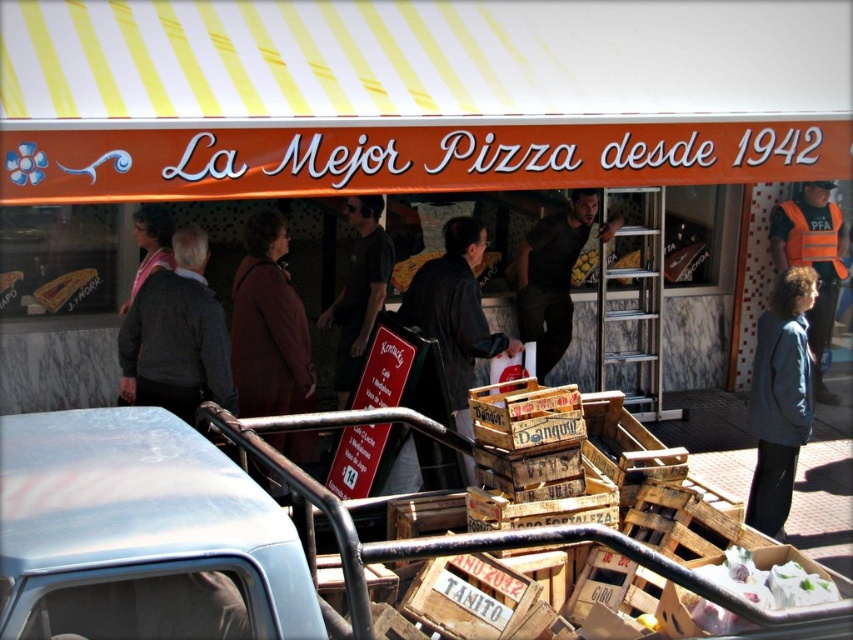
Looking at this image, you are standing in front of the pizza shop and see both the dark brown leather jacket at center and the dark gray shirt at center. Which one is physically closer to you?

The dark brown leather jacket at center is closer to the viewer than the dark gray shirt at center.

You are standing in front of the pizza shop and want to take a photo of the entrance. You notice two points marked on the ground in front of you. The first point is at coordinates point (437, 275) and the second is at point (375, 296). Which point should you stand on to ensure the entrance is more centered in your photo?

You should stand on point (437, 275) because it is closer to the viewer, allowing the entrance to be more centered in your photo compared to standing on point (375, 296) which is further away.

You are a customer standing in front of the pizza shop and see both the dark brown leather jacket at center and the dark gray shirt at center. Which one is positioned more to the right side?

The dark brown leather jacket at center is positioned to the right of the dark gray shirt at center, so the dark brown leather jacket at center is more to the right side.